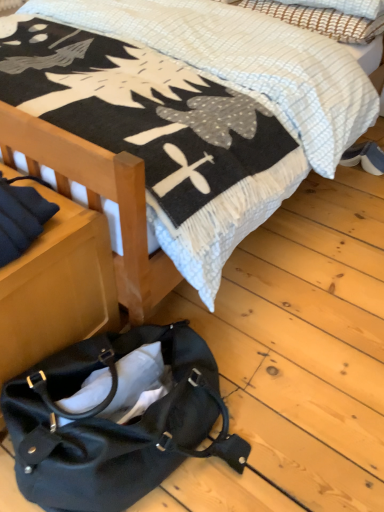
Measure the distance between woven fabric pillow at upper right and camera.

woven fabric pillow at upper right is 1.97 meters from camera.

This screenshot has height=512, width=384. I want to click on matte black handbag at lower left, so click(x=116, y=424).

Locate an element on the screen. woven fabric pillow at upper right is located at coordinates (321, 20).

Which is correct: woven fabric pillow at upper right is inside soft cotton blanket at upper center, or outside of it?

woven fabric pillow at upper right is enclosed within soft cotton blanket at upper center.

From the image's perspective, is woven fabric pillow at upper right above or below soft cotton blanket at upper center?

Clearly, from the image's perspective, woven fabric pillow at upper right is above soft cotton blanket at upper center.

Is point (289, 18) positioned before point (307, 118)?

No, it is behind (307, 118).

Is the position of soft cotton blanket at upper center more distant than that of matte black handbag at lower left?

No, it is in front of matte black handbag at lower left.

From the picture: Is soft cotton blanket at upper center spatially inside matte black handbag at lower left, or outside of it?

soft cotton blanket at upper center is spatially situated outside matte black handbag at lower left.

Does point (145, 21) come in front of point (88, 340)?

No, it is not.

Is soft cotton blanket at upper center positioned far away from matte black handbag at lower left?

Absolutely, soft cotton blanket at upper center is distant from matte black handbag at lower left.

Is blue suede shoes at lower right taller or shorter than woven fabric pillow at upper right?

Considering their sizes, blue suede shoes at lower right has less height than woven fabric pillow at upper right.

Is blue suede shoes at lower right spatially inside woven fabric pillow at upper right, or outside of it?

blue suede shoes at lower right is not enclosed by woven fabric pillow at upper right.

Can you confirm if blue suede shoes at lower right is positioned to the left of woven fabric pillow at upper right?

No, blue suede shoes at lower right is not to the left of woven fabric pillow at upper right.

How distant is blue suede shoes at lower right from woven fabric pillow at upper right?

blue suede shoes at lower right is 23.23 inches from woven fabric pillow at upper right.

What's the angular difference between woven fabric pillow at upper right and matte black handbag at lower left's facing directions?

woven fabric pillow at upper right and matte black handbag at lower left are facing 0.337 degrees away from each other.

Is point (241, 6) closer to camera compared to point (196, 375)?

No, (241, 6) is further to viewer.

Is woven fabric pillow at upper right beside matte black handbag at lower left?

woven fabric pillow at upper right and matte black handbag at lower left are not in contact.

Could you tell me if woven fabric pillow at upper right is facing matte black handbag at lower left?

No, woven fabric pillow at upper right is not turned towards matte black handbag at lower left.

Considering the positions of point (368, 159) and point (333, 96), is point (368, 159) closer or farther from the camera than point (333, 96)?

Point (368, 159).

Based on the photo, who is bigger, blue suede shoes at lower right or soft cotton blanket at upper center?

soft cotton blanket at upper center is bigger.

From their relative heights in the image, would you say blue suede shoes at lower right is taller or shorter than soft cotton blanket at upper center?

Considering their sizes, blue suede shoes at lower right has less height than soft cotton blanket at upper center.

Does point (217, 402) come farther from viewer compared to point (282, 14)?

No, it is not.

Considering their positions, is matte black handbag at lower left located in front of or behind woven fabric pillow at upper right?

Visually, matte black handbag at lower left is located in front of woven fabric pillow at upper right.

Considering the relative sizes of matte black handbag at lower left and woven fabric pillow at upper right in the image provided, is matte black handbag at lower left taller than woven fabric pillow at upper right?

Yes.

Which object is closer to the camera, soft cotton blanket at upper center or woven fabric pillow at upper right?

soft cotton blanket at upper center.

Is soft cotton blanket at upper center looking in the opposite direction of woven fabric pillow at upper right?

Yes, woven fabric pillow at upper right is at the back of soft cotton blanket at upper center.

Measure the distance from soft cotton blanket at upper center to woven fabric pillow at upper right.

The distance of soft cotton blanket at upper center from woven fabric pillow at upper right is 9.84 inches.

Which point is more distant from viewer, (337, 33) or (379, 22)?

The point (379, 22) is behind.

Locate an element on the screen. This screenshot has width=384, height=512. bed below the woven fabric pillow at upper right (from a real-world perspective) is located at coordinates (262, 66).

Find the location of `bed that appears above the matte black handbag at lower left (from the image's perspective)`. bed that appears above the matte black handbag at lower left (from the image's perspective) is located at coordinates (262, 66).

Considering their positions, is soft cotton blanket at upper center positioned closer to matte black handbag at lower left than woven fabric pillow at upper right?

Among the two, soft cotton blanket at upper center is located nearer to matte black handbag at lower left.

From the image, which object appears to be farther from soft cotton blanket at upper center, matte black handbag at lower left or woven fabric pillow at upper right?

matte black handbag at lower left lies further to soft cotton blanket at upper center than the other object.

Estimate the real-world distances between objects in this image. Which object is further from soft cotton blanket at upper center, blue suede shoes at lower right or woven fabric pillow at upper right?

blue suede shoes at lower right is positioned further to the anchor soft cotton blanket at upper center.

Looking at the image, which one is located closer to blue suede shoes at lower right, soft cotton blanket at upper center or matte black handbag at lower left?

soft cotton blanket at upper center is positioned closer to the anchor blue suede shoes at lower right.

When comparing their distances from woven fabric pillow at upper right, does blue suede shoes at lower right or matte black handbag at lower left seem further?

matte black handbag at lower left.

From the image, which object appears to be nearer to soft cotton blanket at upper center, woven fabric pillow at upper right or blue suede shoes at lower right?

Among the two, woven fabric pillow at upper right is located nearer to soft cotton blanket at upper center.

When comparing their distances from matte black handbag at lower left, does woven fabric pillow at upper right or blue suede shoes at lower right seem closer?

blue suede shoes at lower right is positioned closer to the anchor matte black handbag at lower left.

Estimate the real-world distances between objects in this image. Which object is closer to woven fabric pillow at upper right, blue suede shoes at lower right or soft cotton blanket at upper center?

soft cotton blanket at upper center is positioned closer to the anchor woven fabric pillow at upper right.

Locate an element on the screen. Image resolution: width=384 pixels, height=512 pixels. footwear between woven fabric pillow at upper right and matte black handbag at lower left vertically is located at coordinates (365, 157).

Identify the location of handbag between soft cotton blanket at upper center and blue suede shoes at lower right along the z-axis. (116, 424).

What are the coordinates of `bed between woven fabric pillow at upper right and matte black handbag at lower left in the up-down direction` in the screenshot? It's located at (262, 66).

The width and height of the screenshot is (384, 512). What are the coordinates of `pillow between soft cotton blanket at upper center and blue suede shoes at lower right from front to back` in the screenshot? It's located at (321, 20).